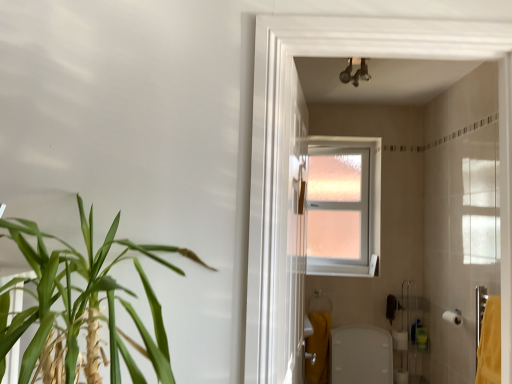
Question: Is yellow fabric bath towel at lower right, which is counted as the first bath towel, starting from the left, to the right of white matte toilet paper at lower right, the first toilet paper from the left, from the viewer's perspective?

Choices:
 (A) yes
 (B) no

Answer: (B)

Question: Is yellow fabric bath towel at lower right, which is counted as the first bath towel, starting from the left, turned away from white matte toilet paper at lower right, the first toilet paper from the left?

Choices:
 (A) yes
 (B) no

Answer: (B)

Question: Would you consider yellow fabric bath towel at lower right, which is counted as the second bath towel, starting from the top, to be distant from white matte toilet paper at lower right, arranged as the second toilet paper when viewed from the right?

Choices:
 (A) no
 (B) yes

Answer: (A)

Question: From the image's perspective, would you say yellow fabric bath towel at lower right, the first bath towel viewed from the back, is positioned over white matte toilet paper at lower right, marked as the first toilet paper in a bottom-to-top arrangement?

Choices:
 (A) no
 (B) yes

Answer: (A)

Question: Would you say white matte toilet paper at lower right, arranged as the second toilet paper when viewed from the top, is part of yellow fabric bath towel at lower right, which is counted as the second bath towel, starting from the top,'s contents?

Choices:
 (A) no
 (B) yes

Answer: (A)

Question: Could you tell me if yellow fabric bath towel at lower right, positioned as the 2th bath towel in right-to-left order, is facing white matte toilet paper at lower right, which is counted as the second toilet paper, starting from the front?

Choices:
 (A) yes
 (B) no

Answer: (B)

Question: Is white matte toilet paper at lower right, placed as the 1th toilet paper when sorted from top to bottom, oriented away from metallic chrome light fixture at upper center?

Choices:
 (A) yes
 (B) no

Answer: (B)

Question: Is white matte toilet paper at lower right, placed as the second toilet paper when sorted from bottom to top, closer to the viewer compared to metallic chrome light fixture at upper center?

Choices:
 (A) yes
 (B) no

Answer: (B)

Question: Considering the relative sizes of white matte toilet paper at lower right, which is the 2th toilet paper in left-to-right order, and metallic chrome light fixture at upper center in the image provided, is white matte toilet paper at lower right, which is the 2th toilet paper in left-to-right order, shorter than metallic chrome light fixture at upper center?

Choices:
 (A) no
 (B) yes

Answer: (B)

Question: Is white matte toilet paper at lower right, placed as the second toilet paper when sorted from back to front, aimed at metallic chrome light fixture at upper center?

Choices:
 (A) no
 (B) yes

Answer: (A)

Question: Is white matte toilet paper at lower right, the first toilet paper positioned from the front, wider than metallic chrome light fixture at upper center?

Choices:
 (A) yes
 (B) no

Answer: (B)

Question: From the image's perspective, is white matte toilet paper at lower right, the first toilet paper positioned from the front, over metallic chrome light fixture at upper center?

Choices:
 (A) yes
 (B) no

Answer: (B)

Question: Are green leafy plant at left and metallic chrome light fixture at upper center located far from each other?

Choices:
 (A) yes
 (B) no

Answer: (A)